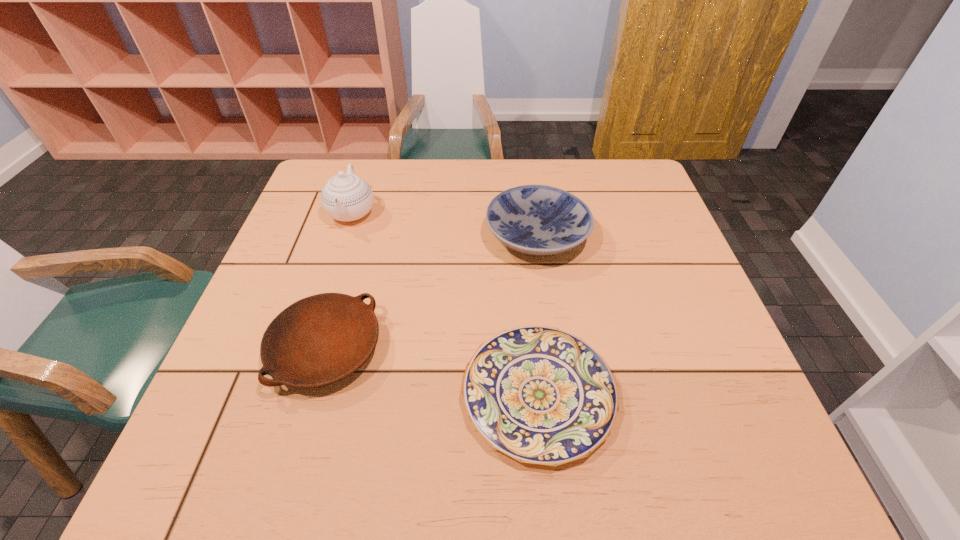
You are a GUI agent. You are given a task and a screenshot of the screen. Output one action in this format:
    pyautogui.click(x=<x>, y=<y>)
    Task: Click on the chinaware at the far edge
    
    Given the screenshot: What is the action you would take?
    pyautogui.click(x=346, y=197)

Find the location of a particular element. plate positioned at the far edge is located at coordinates (539, 220).

What are the coordinates of `object situated at the near edge` in the screenshot? It's located at (538, 394).

In order to click on chinaware that is at the left edge in this screenshot , I will do `click(346, 197)`.

Image resolution: width=960 pixels, height=540 pixels. In order to click on plate that is at the left edge in this screenshot , I will do `click(319, 340)`.

At what (x,y) coordinates should I click in order to perform the action: click on object at the far left corner. Please return your answer as a coordinate pair (x, y). Looking at the image, I should click on (346, 197).

Locate an element on the screen. The height and width of the screenshot is (540, 960). free space at the near edge is located at coordinates (367, 465).

Where is `free space at the left edge of the desktop`? This screenshot has height=540, width=960. free space at the left edge of the desktop is located at coordinates (221, 374).

Image resolution: width=960 pixels, height=540 pixels. In the image, there is a desktop. In order to click on vacant space at the right edge in this screenshot , I will do `click(678, 299)`.

At what (x,y) coordinates should I click in order to perform the action: click on vacant space at the far left corner of the desktop. Please return your answer as a coordinate pair (x, y). This screenshot has width=960, height=540. Looking at the image, I should click on (337, 172).